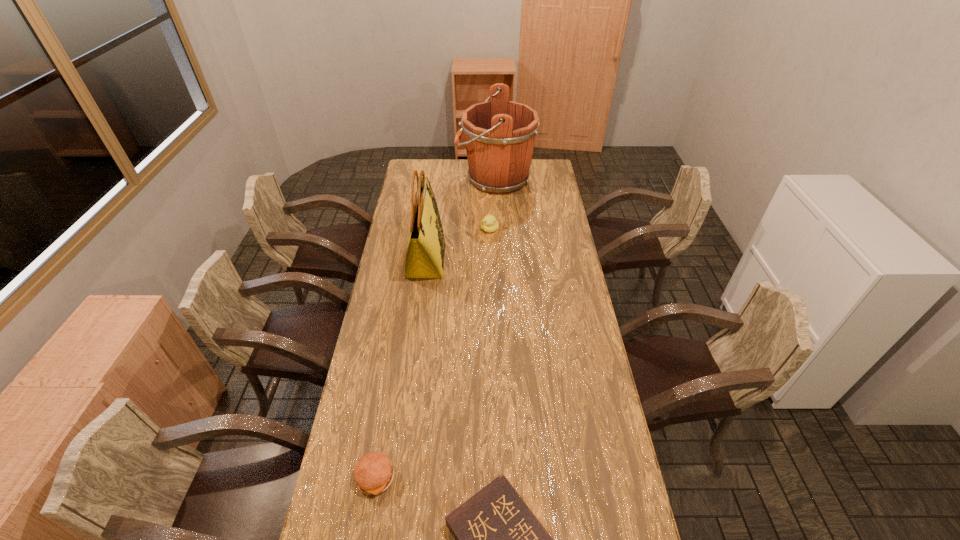
The width and height of the screenshot is (960, 540). Identify the location of the farthest object. (500, 135).

Find the location of a particular element. This screenshot has width=960, height=540. tote bag is located at coordinates (425, 253).

Find the location of `duckling`. duckling is located at coordinates (489, 224).

The height and width of the screenshot is (540, 960). What are the coordinates of `hamburger` in the screenshot? It's located at (373, 474).

Where is `free space located with the handle on the side of the bucket`? free space located with the handle on the side of the bucket is located at coordinates (413, 179).

The image size is (960, 540). I want to click on vacant space located 0.170m with the handle on the side of the bucket, so click(425, 179).

Find the location of `vacant area situated 0.290m with the handle on the side of the bucket`. vacant area situated 0.290m with the handle on the side of the bucket is located at coordinates (403, 179).

The height and width of the screenshot is (540, 960). I want to click on blank area located on the front-facing side of the tote bag, so click(528, 260).

Find the location of `vacant point located at the beak of the duckling`. vacant point located at the beak of the duckling is located at coordinates (490, 247).

Image resolution: width=960 pixels, height=540 pixels. I want to click on vacant area situated 0.350m on the back of the hamburger, so click(x=395, y=361).